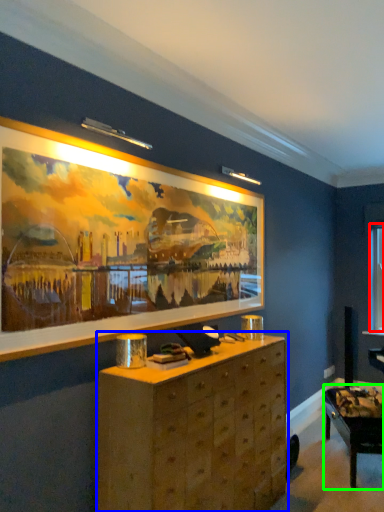
Question: Which is nearer to the window (highlighted by a red box)? chest of drawers (highlighted by a blue box) or table (highlighted by a green box).

Choices:
 (A) chest of drawers
 (B) table

Answer: (B)